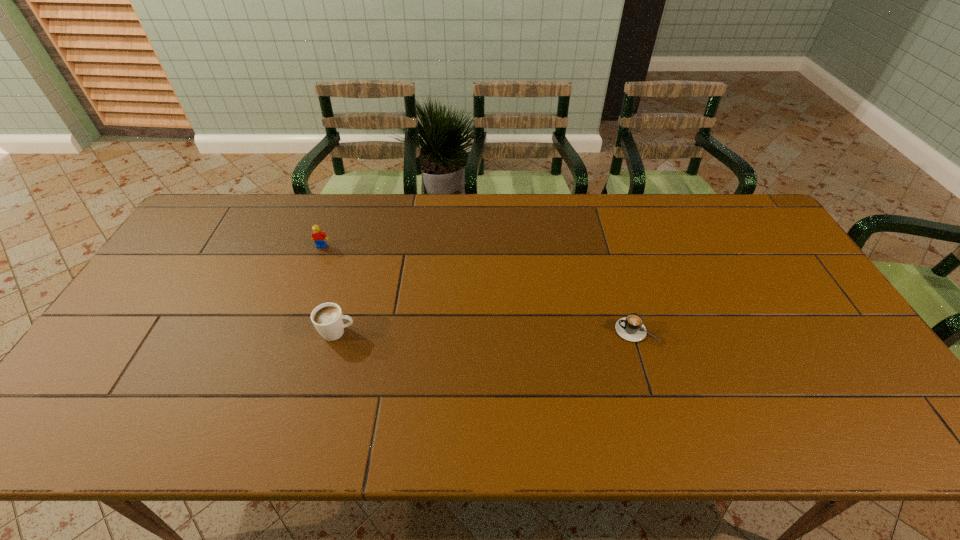
The width and height of the screenshot is (960, 540). In order to click on free space located with the handle on the side of the shortest object in this screenshot , I will do `click(555, 330)`.

The image size is (960, 540). In the image, there is a desktop. What are the coordinates of `vacant space at the far edge` in the screenshot? It's located at (433, 193).

You are a GUI agent. You are given a task and a screenshot of the screen. Output one action in this format:
    pyautogui.click(x=<x>, y=<y>)
    Task: Click on the vacant space at the near edge
    The height and width of the screenshot is (540, 960).
    Given the screenshot: What is the action you would take?
    pyautogui.click(x=261, y=439)

The height and width of the screenshot is (540, 960). What are the coordinates of `vacant space at the left edge of the desktop` in the screenshot? It's located at (114, 386).

In the image, there is a desktop. Where is `vacant region at the right edge`? vacant region at the right edge is located at coordinates (778, 244).

Identify the location of free space at the far left corner. The width and height of the screenshot is (960, 540). (216, 228).

You are a GUI agent. You are given a task and a screenshot of the screen. Output one action in this format:
    pyautogui.click(x=<x>, y=<y>)
    Task: Click on the free spot at the near left corner of the desktop
    
    Given the screenshot: What is the action you would take?
    pyautogui.click(x=60, y=424)

The height and width of the screenshot is (540, 960). I want to click on free space between the farthest object and the shortest object, so click(479, 288).

Where is `blank region between the Lego and the taller cappuccino`? Image resolution: width=960 pixels, height=540 pixels. blank region between the Lego and the taller cappuccino is located at coordinates (329, 289).

Find the location of a particular element. This screenshot has width=960, height=540. free space between the left cappuccino and the leftmost object is located at coordinates (329, 289).